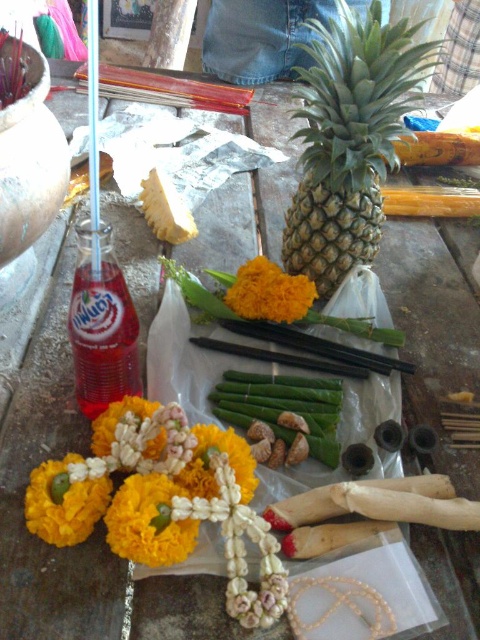
You are organizing a traditional ceremony and need to place the green textured pineapple at center and the yellow fabric flower at lower left in a specific arrangement. According to the image, which object is located to the right of the other?

The green textured pineapple at center is positioned on the right side of yellow fabric flower at lower left.

You are setting up an altar for a ceremony and need to place the green textured pineapple at center and the yellow fabric garland at center. Which object should be placed higher to ensure proper visibility?

The green textured pineapple at center is much taller than the yellow fabric garland at center, so it should be placed higher to ensure proper visibility.

You are a delivery person who needs to place a 30 cm wide box between the green textured pineapple at center and the translucent plastic bottle at upper left. Can you fit the box between them without moving either object?

The green textured pineapple at center and the translucent plastic bottle at upper left are 31.60 centimeters apart. Since the box is 30 cm wide, it can fit between them as the distance is slightly larger than the box.